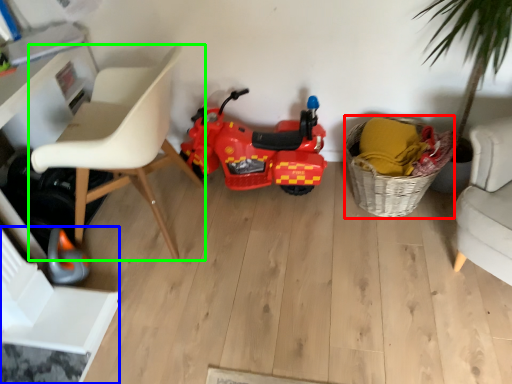
Question: Considering the real-world distances, which object is closest to basket (highlighted by a red box)? swivel chair (highlighted by a blue box) or chair (highlighted by a green box).

Choices:
 (A) swivel chair
 (B) chair

Answer: (B)